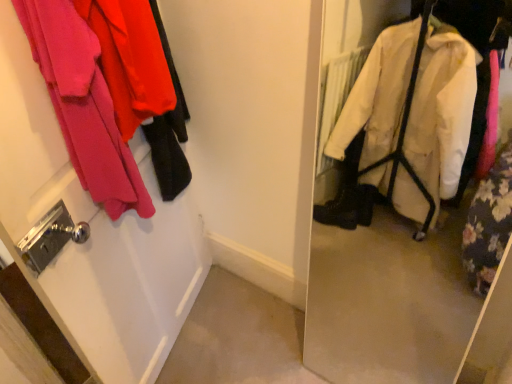
Question: Is white matte door at left looking in the opposite direction of matte pink fabric at upper left?

Choices:
 (A) yes
 (B) no

Answer: (A)

Question: Is white matte door at left completely or partially outside of matte pink fabric at upper left?

Choices:
 (A) no
 (B) yes

Answer: (B)

Question: Is white matte door at left further to the viewer compared to matte pink fabric at upper left?

Choices:
 (A) no
 (B) yes

Answer: (A)

Question: From the image's perspective, is white matte door at left beneath matte pink fabric at upper left?

Choices:
 (A) no
 (B) yes

Answer: (B)

Question: Is white matte door at left facing towards matte pink fabric at upper left?

Choices:
 (A) no
 (B) yes

Answer: (B)

Question: From a real-world perspective, is white matte door at left located higher than matte pink fabric at upper left?

Choices:
 (A) yes
 (B) no

Answer: (B)

Question: Does matte pink fabric at upper left have a greater width compared to white matte door at left?

Choices:
 (A) yes
 (B) no

Answer: (A)

Question: Is matte pink fabric at upper left far from white matte door at left?

Choices:
 (A) yes
 (B) no

Answer: (B)

Question: From the image's perspective, is matte pink fabric at upper left on top of white matte door at left?

Choices:
 (A) yes
 (B) no

Answer: (A)

Question: Considering the relative positions of matte pink fabric at upper left and white matte door at left in the image provided, is matte pink fabric at upper left to the left of white matte door at left from the viewer's perspective?

Choices:
 (A) yes
 (B) no

Answer: (B)

Question: From a real-world perspective, is matte pink fabric at upper left physically above white matte door at left?

Choices:
 (A) yes
 (B) no

Answer: (A)

Question: Is matte pink fabric at upper left to the right of white matte door at left from the viewer's perspective?

Choices:
 (A) no
 (B) yes

Answer: (B)

Question: From the image's perspective, is matte pink fabric at upper left located above or below white matte door at left?

Choices:
 (A) below
 (B) above

Answer: (B)